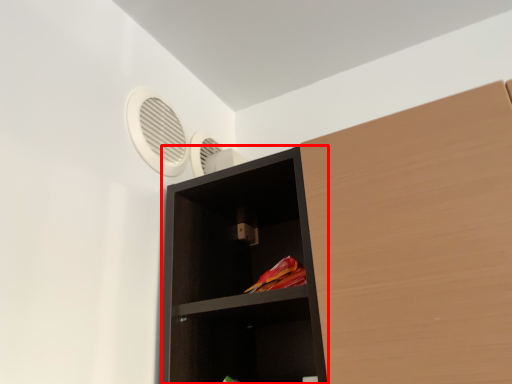
Question: From the image's perspective, considering the relative positions of shelf (annotated by the red box) and fan in the image provided, where is shelf (annotated by the red box) located with respect to the staircase?

Choices:
 (A) below
 (B) above

Answer: (A)